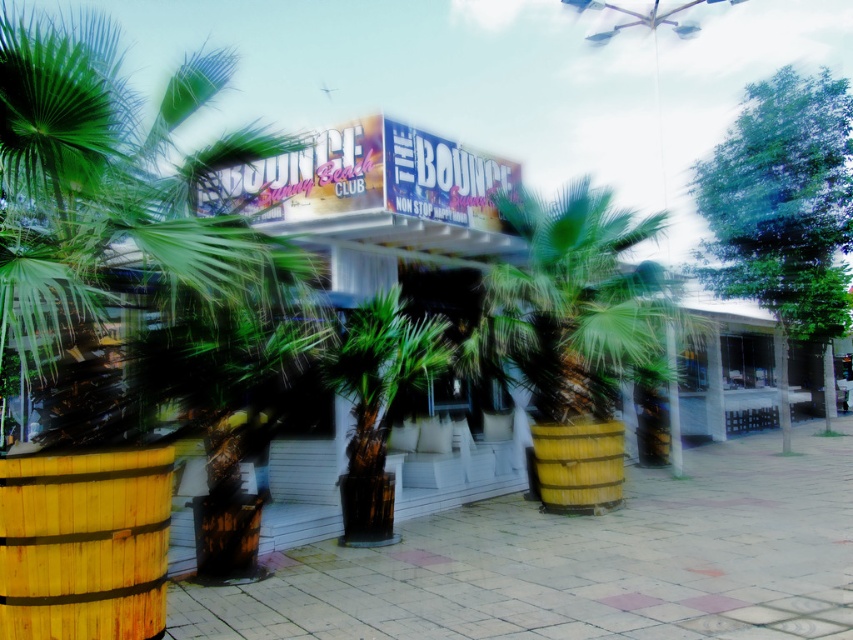
You are planning to place a new bench in the outdoor area in front of THE BOUNCE building. The bench needs to be placed where there is enough space between the green wooden palm tree at center and the wooden barrel at center. Can you confirm if there is enough space between them for the bench?

The green wooden palm tree at center is taller than the wooden barrel at center, but the description does not provide information about the distance between them. Therefore, it is unclear if there is enough space for the bench between them.

You are planning to place a new bench in the outdoor area of THE BOUNCE club. The bench requires a space wider than the wooden barrel at lower left but narrower than the green textured palm tree at center. Is there enough space between them to fit the bench?

The wooden barrel at lower left is narrower than the green textured palm tree at center. Since the bench needs a space wider than the barrel but narrower than the palm tree, there is sufficient space between them to accommodate the bench.

You are standing at the entrance of THE BOUNCE club and see the wooden barrel at lower left and the wooden barrel at center. Which barrel is positioned higher from the ground?

The wooden barrel at lower left is located above the wooden barrel at center, so it is positioned higher from the ground.